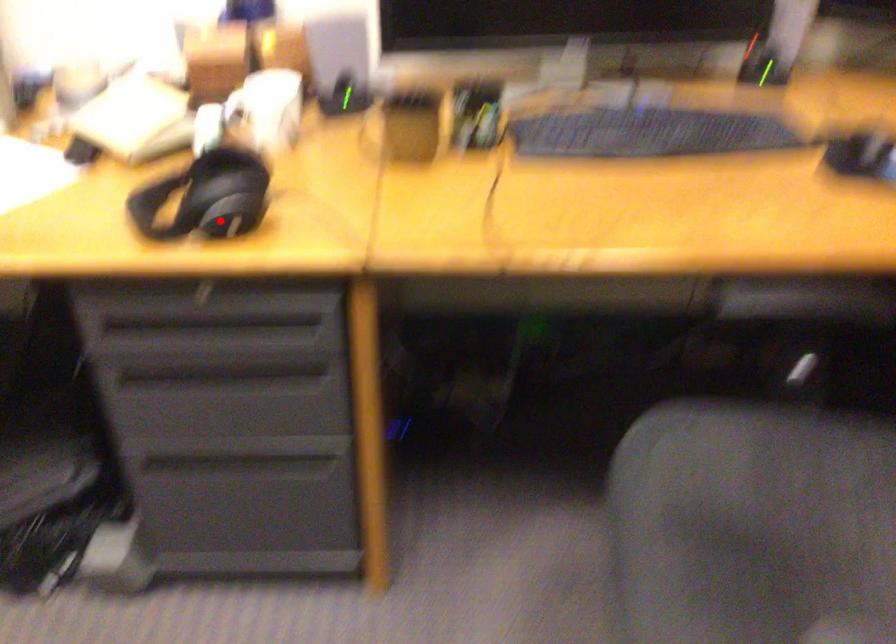
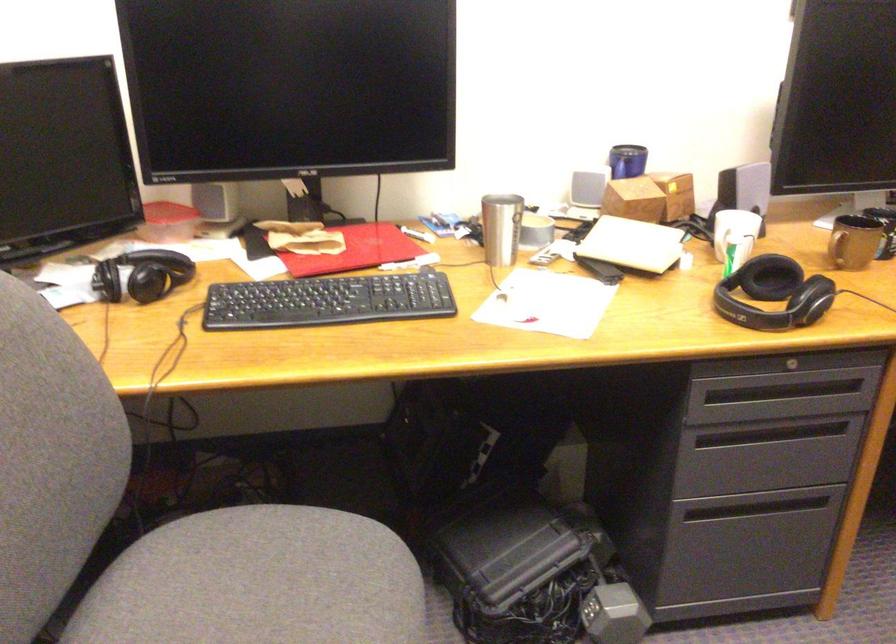
Question: I am providing you with two images of the same scene from different viewpoints. A red point is shown in image1. For the corresponding object point in image2, is it positioned nearer or farther from the camera?

Choices:
 (A) Nearer
 (B) Farther

Answer: (B)